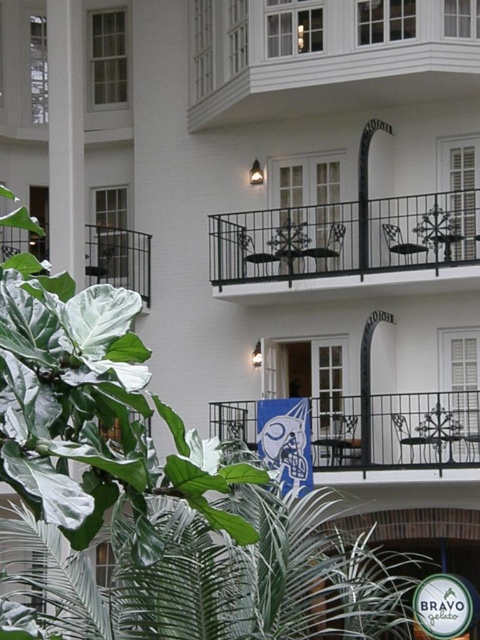
You are an architect evaluating the building design. You notice the white smooth pillar at upper left and the black wrought iron balcony at left. Which architectural element is bigger in size?

The white smooth pillar at upper left is larger in size compared to the black wrought iron balcony at left.

You are standing on the ground floor looking up at the building. Which balcony, the white painted wood balcony at upper center or the metallic wrought iron balcony at center, is higher from the ground?

The white painted wood balcony at upper center is higher from the ground than the metallic wrought iron balcony at center because it is located above it.

In the scene shown: You are standing in front of the building and notice two balconies. The white painted wood balcony at upper center and the black wrought iron balcony at center. Which balcony is positioned more to the left side of the building?

The white painted wood balcony at upper center is positioned more to the left side of the building compared to the black wrought iron balcony at center.